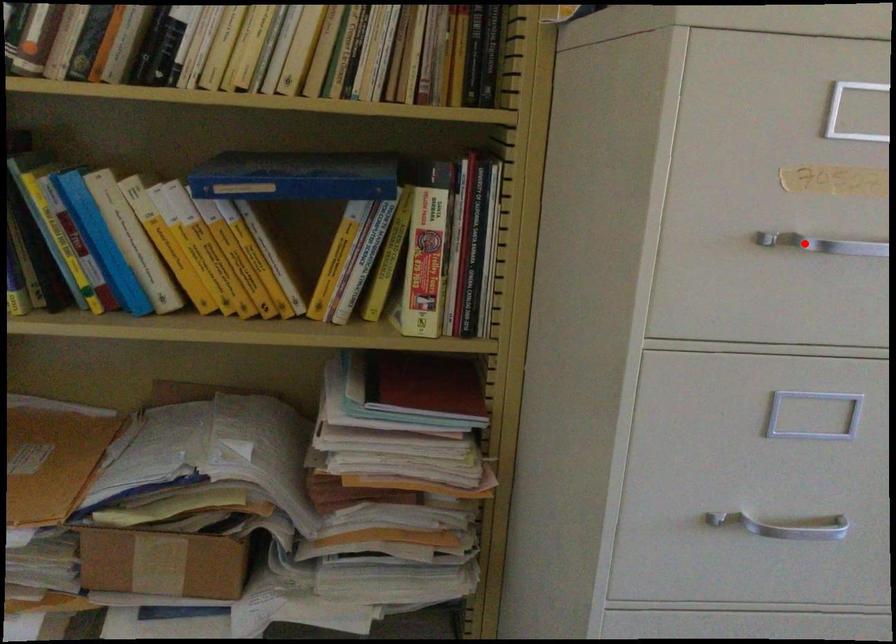
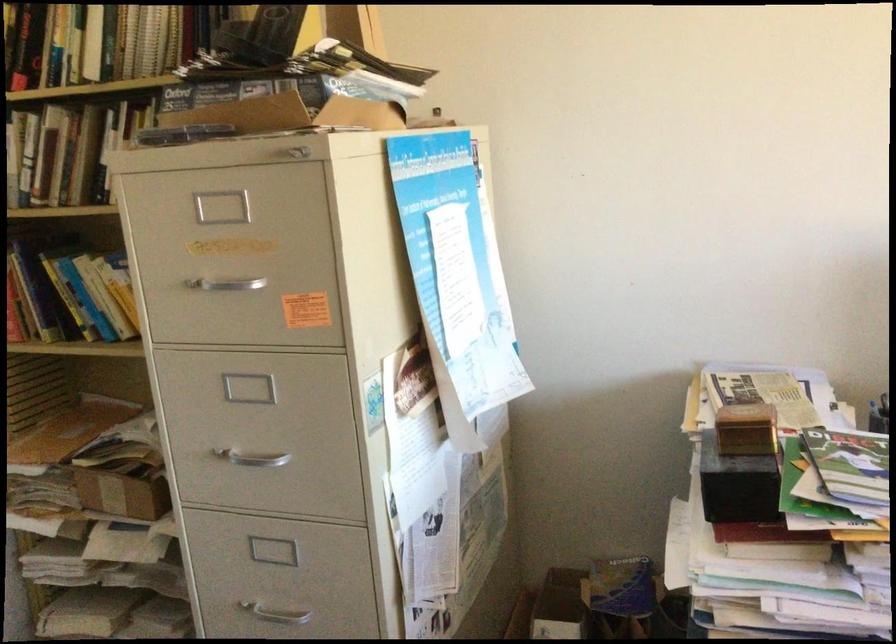
Find the pixel in the second image that matches the highlighted location in the first image.

(224, 283)